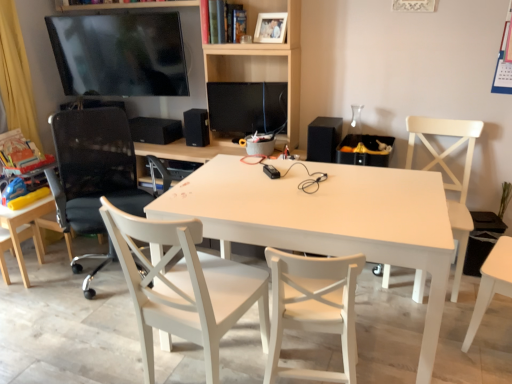
The width and height of the screenshot is (512, 384). What do you see at coordinates (184, 286) in the screenshot?
I see `white wood chair at center, the third chair from the left` at bounding box center [184, 286].

Measure the distance between black matte speaker at center, which is counted as the second speaker, starting from the right, and camera.

The distance of black matte speaker at center, which is counted as the second speaker, starting from the right, from camera is 9.72 feet.

Describe the element at coordinates (196, 127) in the screenshot. Image resolution: width=512 pixels, height=384 pixels. I see `black matte speaker at center, the 2th speaker viewed from the back` at that location.

What do you see at coordinates (155, 130) in the screenshot? I see `black matte speaker at center, which is the 1th speaker in back-to-front order` at bounding box center [155, 130].

This screenshot has height=384, width=512. What do you see at coordinates (324, 139) in the screenshot?
I see `black matte speaker at right, acting as the 3th speaker starting from the left` at bounding box center [324, 139].

Describe the element at coordinates (327, 219) in the screenshot. This screenshot has height=384, width=512. I see `white matte table at center` at that location.

Where is `white wood chair at center, the third chair from the left`? The height and width of the screenshot is (384, 512). white wood chair at center, the third chair from the left is located at coordinates (184, 286).

Does point (178, 123) come closer to viewer compared to point (252, 224)?

No, it is behind (252, 224).

Considering the relative sizes of black matte speaker at center, the first speaker from the left, and white matte table at center in the image provided, is black matte speaker at center, the first speaker from the left, smaller than white matte table at center?

Yes.

Measure the distance between black matte speaker at center, the first speaker from the left, and white matte table at center.

The distance of black matte speaker at center, the first speaker from the left, from white matte table at center is 1.37 meters.

What are the coordinates of `the 2nd speaker to the left of the white matte table at center, starting your count from the anchor` in the screenshot? It's located at (155, 130).

How many degrees apart are the facing directions of white matte chair at right, arranged as the first chair when viewed from the right, and light wood chair at lower left, the first chair from the left?

178 degrees.

Consider the image. Is white matte chair at right, arranged as the first chair when viewed from the right, further to camera compared to light wood chair at lower left, which ranks as the fifth chair in right-to-left order?

No, white matte chair at right, arranged as the first chair when viewed from the right, is closer to the viewer.

Considering the sizes of objects white matte chair at right, arranged as the first chair when viewed from the right, and light wood chair at lower left, the first chair from the left, in the image provided, who is smaller, white matte chair at right, arranged as the first chair when viewed from the right, or light wood chair at lower left, the first chair from the left,?

Smaller between the two is light wood chair at lower left, the first chair from the left.

Is white matte chair at right, arranged as the first chair when viewed from the right, not inside light wood chair at lower left, the first chair from the left?

Yes, white matte chair at right, arranged as the first chair when viewed from the right, is not within light wood chair at lower left, the first chair from the left.

From the image's perspective, is matte black monitor at center on white wood chair at center, the third chair from the left?

Indeed, from the image's perspective, matte black monitor at center is shown above white wood chair at center, the third chair from the left.

Identify the location of computer monitor to the right of white wood chair at center, the third chair from the left. The image size is (512, 384). (247, 107).

Is matte black monitor at center closer to camera compared to white wood chair at center, the 3th chair positioned from the right?

No.

Could you measure the distance between matte black monitor at center and white wood chair at center, the 3th chair positioned from the right?

They are 4.43 feet apart.

Considering the positions of objects white matte table at center and matte black tv at upper left in the image provided, who is behind, white matte table at center or matte black tv at upper left?

matte black tv at upper left.

Can you tell me how much white matte table at center and matte black tv at upper left differ in facing direction?

The facing directions of white matte table at center and matte black tv at upper left are 10.2 degrees apart.

From a real-world perspective, is white matte table at center physically above matte black tv at upper left?

Actually, white matte table at center is physically below matte black tv at upper left in the real world.

From the image's perspective, which object appears higher, matte black tv at upper left or black matte speaker at center, arranged as the 3th speaker when viewed from the front?

matte black tv at upper left is shown above in the image.

Does matte black tv at upper left appear on the left side of black matte speaker at center, the 3th speaker viewed from the right?

Yes, matte black tv at upper left is to the left of black matte speaker at center, the 3th speaker viewed from the right.

I want to click on speaker that is the 2nd one when counting backward from the matte black tv at upper left, so click(155, 130).

From a real-world perspective, which is physically below, matte black tv at upper left or black matte speaker at center, the first speaker from the left?

black matte speaker at center, the first speaker from the left, from a real-world perspective.

Considering the sizes of white wood chair at center, the 3th chair positioned from the right, and black matte speaker at right, acting as the 3th speaker starting from the left, in the image, is white wood chair at center, the 3th chair positioned from the right, wider or thinner than black matte speaker at right, acting as the 3th speaker starting from the left,?

Clearly, white wood chair at center, the 3th chair positioned from the right, has more width compared to black matte speaker at right, acting as the 3th speaker starting from the left.

From the image's perspective, between white wood chair at center, the third chair from the left, and black matte speaker at right, which ranks as the first speaker in front-to-back order, which one is located above?

black matte speaker at right, which ranks as the first speaker in front-to-back order, from the image's perspective.

Is white wood chair at center, the third chair from the left, positioned beyond the bounds of black matte speaker at right, which ranks as the first speaker in front-to-back order?

Yes.

Is white wood chair at center, the third chair from the left, in front of or behind black matte speaker at right, the 1th speaker positioned from the right, in the image?

white wood chair at center, the third chair from the left, is positioned closer to the viewer than black matte speaker at right, the 1th speaker positioned from the right.

Is light wood chair at lower left, the first chair from the left, located outside wooden bookshelf at upper center?

light wood chair at lower left, the first chair from the left, lies outside wooden bookshelf at upper center's area.

Between point (40, 257) and point (295, 130), which one is positioned in front?

The point (40, 257) is more forward.

Is the position of light wood chair at lower left, the first chair from the left, more distant than that of wooden bookshelf at upper center?

Yes.

How different are the orientations of light wood chair at lower left, the first chair from the left, and wooden bookshelf at upper center in degrees?

The angle between the facing direction of light wood chair at lower left, the first chair from the left, and the facing direction of wooden bookshelf at upper center is 180 degrees.

At what (x,y) coordinates should I click in order to perform the action: click on table below the black matte speaker at center, which is the 1th speaker in back-to-front order (from the image's perspective). Please return your answer as a coordinate pair (x, y). Looking at the image, I should click on (327, 219).

You are a GUI agent. You are given a task and a screenshot of the screen. Output one action in this format:
    pyautogui.click(x=<x>, y=<y>)
    Task: Click on the 1st chair in front of the light wood chair at lower left, the first chair from the left
    The width and height of the screenshot is (512, 384).
    Given the screenshot: What is the action you would take?
    pyautogui.click(x=449, y=175)

From the picture: From the image, which object appears to be farther from light wood chair at lower left, which ranks as the fifth chair in right-to-left order, wooden bookshelf at upper center or white wood chair at center, the 3th chair positioned from the right?

Among the two, wooden bookshelf at upper center is located further to light wood chair at lower left, which ranks as the fifth chair in right-to-left order.

Which object lies further to the anchor point black matte speaker at center, which is counted as the second speaker, starting from the right, wooden bookshelf at upper center or white matte chair at right, arranged as the first chair when viewed from the right?

The object further to black matte speaker at center, which is counted as the second speaker, starting from the right, is white matte chair at right, arranged as the first chair when viewed from the right.

Estimate the real-world distances between objects in this image. Which object is closer to white wood chair at center, which is the 4th chair from left to right, matte black tv at upper left or white matte table at center?

Based on the image, white matte table at center appears to be nearer to white wood chair at center, which is the 4th chair from left to right.

From the image, which object appears to be nearer to black matte speaker at center, the 3th speaker viewed from the right, matte black tv at upper left or white wood chair at center, the 3th chair positioned from the right?

matte black tv at upper left is positioned closer to the anchor black matte speaker at center, the 3th speaker viewed from the right.

From the picture: Considering their positions, is white wood chair at center, which is the 4th chair from left to right, positioned closer to matte black tv at upper left than black matte speaker at right, the 1th speaker positioned from the right?

black matte speaker at right, the 1th speaker positioned from the right.

From the picture: Considering their positions, is white matte picture frame at upper center positioned further to white matte chair at right, arranged as the first chair when viewed from the right, than matte black monitor at center?

white matte picture frame at upper center lies further to white matte chair at right, arranged as the first chair when viewed from the right, than the other object.

When comparing their distances from white matte chair at right, arranged as the first chair when viewed from the right, does matte black monitor at center or wooden bookshelf at upper center seem closer?

wooden bookshelf at upper center lies closer to white matte chair at right, arranged as the first chair when viewed from the right, than the other object.

From the image, which object appears to be farther from white matte chair at right, the fifth chair when ordered from left to right, white wood chair at center, which is the 4th chair from left to right, or black matte speaker at right, acting as the 3th speaker starting from the left?

white wood chair at center, which is the 4th chair from left to right.

Identify the location of table situated between white wood chair at center, the 3th chair positioned from the right, and white matte chair at right, the fifth chair when ordered from left to right, from left to right. The width and height of the screenshot is (512, 384). (327, 219).

Where is `television between white matte table at center and black matte speaker at center, which is counted as the second speaker, starting from the right, along the z-axis`? Image resolution: width=512 pixels, height=384 pixels. television between white matte table at center and black matte speaker at center, which is counted as the second speaker, starting from the right, along the z-axis is located at coordinates (120, 54).

Locate an element on the screen. This screenshot has width=512, height=384. bookshelf located between black mesh office chair at left, marked as the 4th chair in a right-to-left arrangement, and white wood chair at center, which is the 4th chair from left to right, in the left-right direction is located at coordinates (263, 60).

Where is `computer monitor between white matte picture frame at upper center and black mesh office chair at left, marked as the 4th chair in a right-to-left arrangement, in the vertical direction`? This screenshot has width=512, height=384. computer monitor between white matte picture frame at upper center and black mesh office chair at left, marked as the 4th chair in a right-to-left arrangement, in the vertical direction is located at coordinates (247, 107).